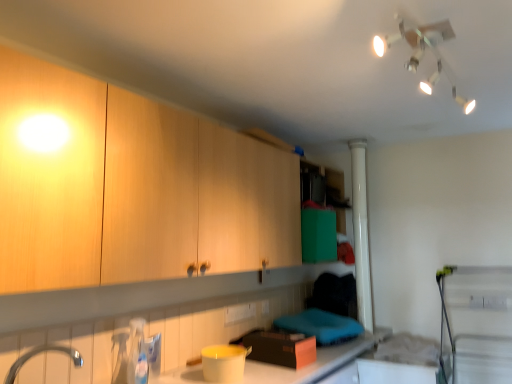
This screenshot has width=512, height=384. What are the coordinates of `free spot above white plastic light fixture at upper center (from a real-world perspective)` in the screenshot? It's located at (428, 39).